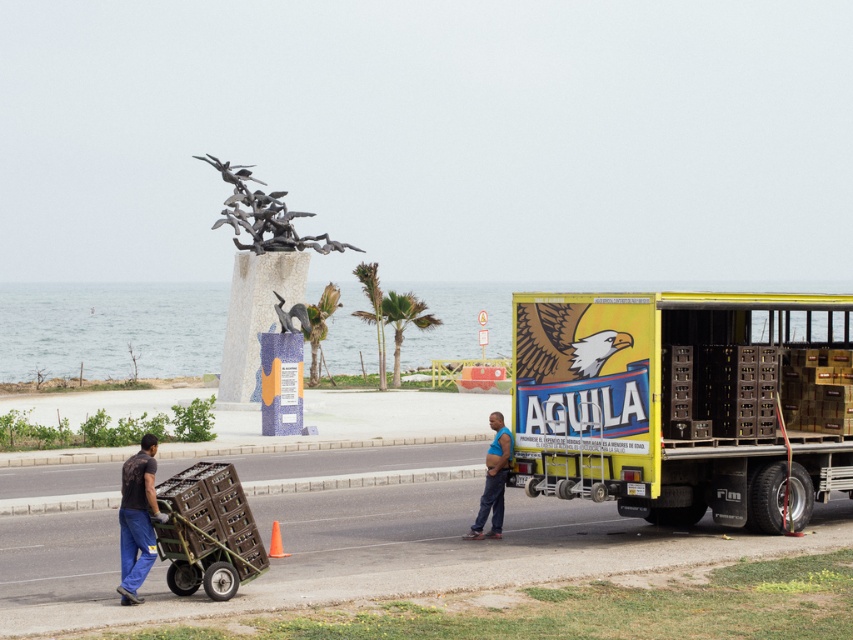
Question: Does yellow matte trailer truck at right appear under wooden crates at lower left?

Choices:
 (A) no
 (B) yes

Answer: (A)

Question: Can you confirm if dark blue jeans at lower left is positioned above blue fabric shirt at center?

Choices:
 (A) yes
 (B) no

Answer: (A)

Question: Does dark blue jeans at lower left have a lesser width compared to blue fabric shirt at center?

Choices:
 (A) no
 (B) yes

Answer: (B)

Question: Which point appears farthest from the camera in this image?

Choices:
 (A) (541, 444)
 (B) (492, 472)
 (C) (129, 600)
 (D) (184, 582)

Answer: (B)

Question: Estimate the real-world distances between objects in this image. Which object is closer to the wooden crates at lower left?

Choices:
 (A) yellow matte trailer truck at right
 (B) blue fabric shirt at center

Answer: (B)

Question: Which point is closer to the camera?

Choices:
 (A) (202, 476)
 (B) (498, 465)

Answer: (A)